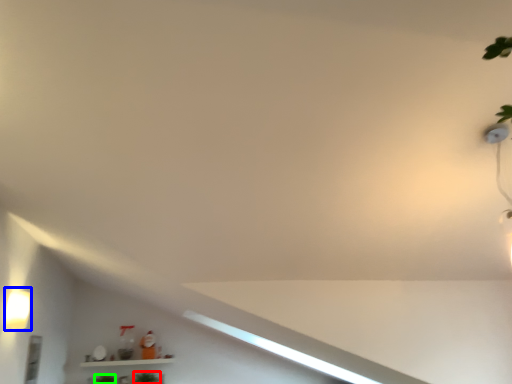
Question: Considering the real-world distances, which object is farthest from plant (highlighted by a red box)? light fixture (highlighted by a blue box) or plant (highlighted by a green box)?

Choices:
 (A) light fixture
 (B) plant

Answer: (A)